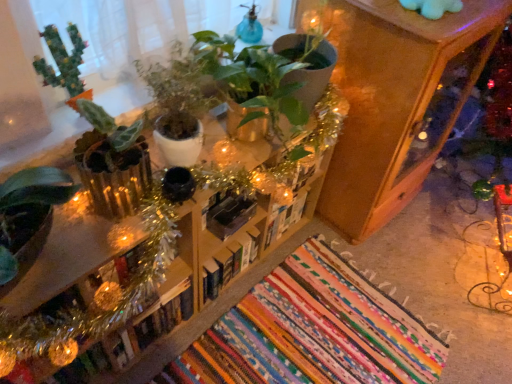
Find the location of a particular element. vacant area that is in front of white matte book at center, acting as the 1th book starting from the right is located at coordinates (283, 274).